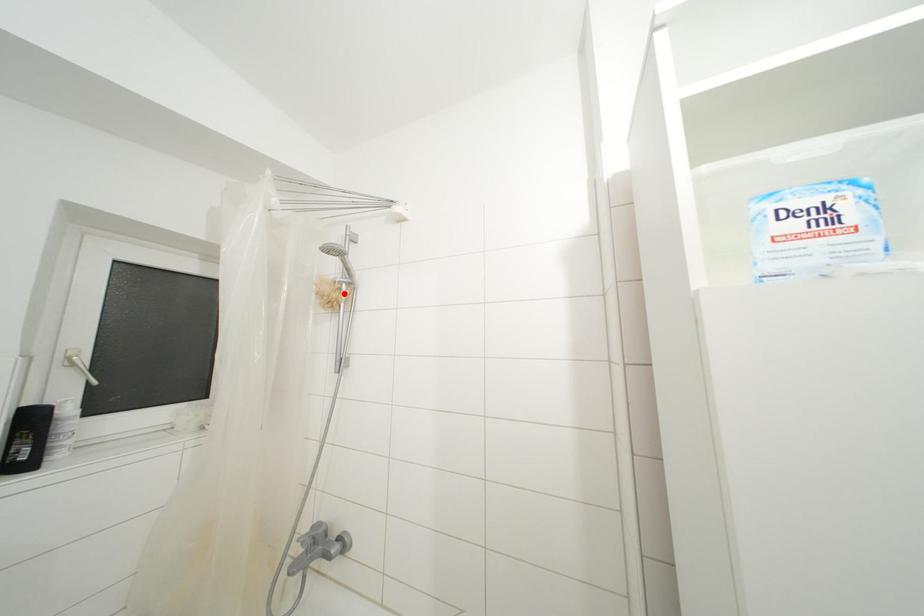
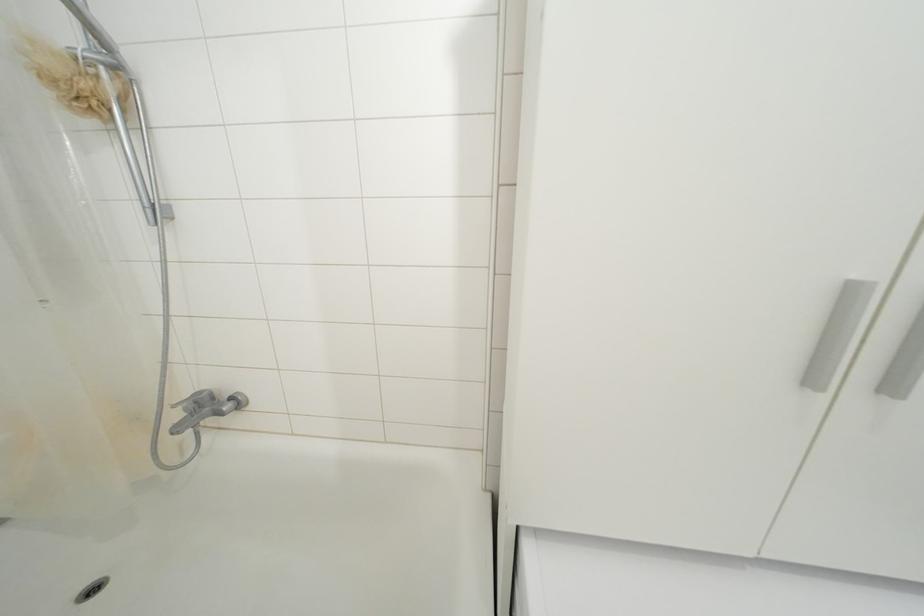
Find the pixel in the second image that matches the highlighted location in the first image.

(100, 79)